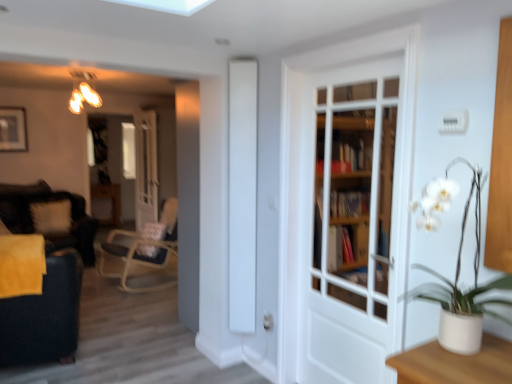
In order to face velvet black swivel chair at left, should I rotate leftwards or rightwards?

Turn left approximately 27.344 degrees to face it.

The width and height of the screenshot is (512, 384). Find the location of `velvet black swivel chair at left`. velvet black swivel chair at left is located at coordinates (44, 315).

The image size is (512, 384). What do you see at coordinates (13, 129) in the screenshot?
I see `matte black picture frame at upper left` at bounding box center [13, 129].

The width and height of the screenshot is (512, 384). What do you see at coordinates (146, 168) in the screenshot? I see `white glossy door at center, placed as the 2th door when sorted from right to left` at bounding box center [146, 168].

Describe the element at coordinates (83, 92) in the screenshot. I see `matte brass chandelier at upper left` at that location.

The height and width of the screenshot is (384, 512). I want to click on white fluffy pillow at left, so click(52, 216).

Where is `velvet black swivel chair at left`? The height and width of the screenshot is (384, 512). velvet black swivel chair at left is located at coordinates (44, 315).

Would you say white glossy door at center, the second door in the front-to-back sequence, is outside white ceramic vase at right?

Yes, white glossy door at center, the second door in the front-to-back sequence, is outside of white ceramic vase at right.

What's the angular difference between white glossy door at center, positioned as the 1th door in back-to-front order, and white ceramic vase at right's facing directions?

The angular difference between white glossy door at center, positioned as the 1th door in back-to-front order, and white ceramic vase at right is 5.08 degrees.

From a real-world perspective, is white glossy door at center, the second door in the front-to-back sequence, physically located above or below white ceramic vase at right?

From a real-world perspective, white glossy door at center, the second door in the front-to-back sequence, is physically below white ceramic vase at right.

Does white glossy door at center, positioned as the first door in left-to-right order, appear on the left side of white ceramic vase at right?

Yes, white glossy door at center, positioned as the first door in left-to-right order, is to the left of white ceramic vase at right.

From a real-world perspective, relative to white fluffy pillow at left, is white glossy door at center, placed as the 2th door when sorted from right to left, vertically above or below?

white glossy door at center, placed as the 2th door when sorted from right to left, is situated higher than white fluffy pillow at left in the real world.

Does white glossy door at center, positioned as the 1th door in back-to-front order, contain white fluffy pillow at left?

No, white fluffy pillow at left is not surrounded by white glossy door at center, positioned as the 1th door in back-to-front order.

Considering the sizes of objects white glossy door at center, the second door in the front-to-back sequence, and white fluffy pillow at left in the image provided, who is wider, white glossy door at center, the second door in the front-to-back sequence, or white fluffy pillow at left?

Wider between the two is white fluffy pillow at left.

From a real-world perspective, count 1st doors upward from the white fluffy pillow at left and point to it. Please provide its 2D coordinates.

[(146, 168)]

I want to click on light fixture in front of the matte black picture frame at upper left, so click(83, 92).

In terms of width, does matte brass chandelier at upper left look wider or thinner when compared to matte black picture frame at upper left?

In the image, matte brass chandelier at upper left appears to be wider than matte black picture frame at upper left.

Considering the sizes of objects matte brass chandelier at upper left and matte black picture frame at upper left in the image provided, who is taller, matte brass chandelier at upper left or matte black picture frame at upper left?

matte black picture frame at upper left is taller.

How different are the orientations of matte brass chandelier at upper left and matte black picture frame at upper left in degrees?

They differ by 0.832 degrees in their facing directions.

Which is nearer, [452,282] or [8,119]?

Clearly, point [452,282] is closer to the camera than point [8,119].

Locate an element on the screen. This screenshot has width=512, height=384. picture frame behind the white ceramic vase at right is located at coordinates pyautogui.click(x=13, y=129).

Which of these two, white ceramic vase at right or matte black picture frame at upper left, is smaller?

matte black picture frame at upper left is smaller.

Looking at the image, does white glossy screen door at center seem bigger or smaller compared to white wooden door at center, placed as the 1th door when sorted from front to back?

Clearly, white glossy screen door at center is smaller in size than white wooden door at center, placed as the 1th door when sorted from front to back.

Between white glossy screen door at center and white wooden door at center, the second door when ordered from left to right, which one is positioned in front?

white wooden door at center, the second door when ordered from left to right.

Is white glossy screen door at center far from white wooden door at center, the second door when ordered from left to right?

Actually, white glossy screen door at center and white wooden door at center, the second door when ordered from left to right, are a little close together.

Identify the location of screen door above the white wooden door at center, which is the 1th door from right to left (from a real-world perspective). Image resolution: width=512 pixels, height=384 pixels. (242, 194).

Is white wooden door at center, placed as the second door when sorted from back to front, looking in the opposite direction of matte black picture frame at upper left?

No, white wooden door at center, placed as the second door when sorted from back to front, is not facing away from matte black picture frame at upper left.

Is white wooden door at center, placed as the second door when sorted from back to front, surrounding matte black picture frame at upper left?

That's incorrect, matte black picture frame at upper left is not inside white wooden door at center, placed as the second door when sorted from back to front.

Is point (310, 270) closer to viewer compared to point (20, 135)?

Yes, it is in front of point (20, 135).

This screenshot has width=512, height=384. I want to click on door in front of the matte black picture frame at upper left, so click(x=350, y=222).

Consider the image. Is white fluffy pillow at left inside white glossy screen door at center?

No, white fluffy pillow at left is located outside of white glossy screen door at center.

Is white glossy screen door at center bigger or smaller than white fluffy pillow at left?

Clearly, white glossy screen door at center is smaller in size than white fluffy pillow at left.

Is white glossy screen door at center shorter than white fluffy pillow at left?

In fact, white glossy screen door at center may be taller than white fluffy pillow at left.

The width and height of the screenshot is (512, 384). Identify the location of houseplant located below the white glossy door at center, the second door in the front-to-back sequence (from the image's perspective). (463, 288).

This screenshot has height=384, width=512. I want to click on pillow on the left of white glossy door at center, the second door in the front-to-back sequence, so click(52, 216).

Estimate the real-world distances between objects in this image. Which object is closer to white ceramic vase at right, white glossy door at center, positioned as the first door in left-to-right order, or matte brass chandelier at upper left?

matte brass chandelier at upper left.

Looking at the image, which one is located further to matte brass chandelier at upper left, white glossy door at center, placed as the 2th door when sorted from right to left, or matte black picture frame at upper left?

white glossy door at center, placed as the 2th door when sorted from right to left.

From the image, which object appears to be nearer to white wooden door at center, placed as the second door when sorted from back to front, matte black picture frame at upper left or white glossy door at center, placed as the 2th door when sorted from right to left?

white glossy door at center, placed as the 2th door when sorted from right to left.

Based on their spatial positions, is matte black picture frame at upper left or white glossy door at center, placed as the 2th door when sorted from right to left, closer to white ceramic vase at right?

matte black picture frame at upper left lies closer to white ceramic vase at right than the other object.

From the picture: Looking at the image, which one is located further to white fluffy pillow at left, white ceramic vase at right or matte black picture frame at upper left?

white ceramic vase at right is further to white fluffy pillow at left.

Considering their positions, is matte brass chandelier at upper left positioned further to white glossy screen door at center than white fluffy pillow at left?

matte brass chandelier at upper left is further to white glossy screen door at center.

Based on their spatial positions, is white ceramic vase at right or white fluffy pillow at left closer to matte brass chandelier at upper left?

white fluffy pillow at left lies closer to matte brass chandelier at upper left than the other object.

When comparing their distances from white glossy screen door at center, does matte black picture frame at upper left or white fluffy pillow at left seem closer?

white fluffy pillow at left is closer to white glossy screen door at center.

This screenshot has width=512, height=384. What are the coordinates of `door between velvet black swivel chair at left and white ceramic vase at right` in the screenshot? It's located at (350, 222).

Find the location of a particular element. The height and width of the screenshot is (384, 512). swivel chair between white wooden door at center, placed as the 1th door when sorted from front to back, and matte black picture frame at upper left in the front-back direction is located at coordinates (44, 315).

The width and height of the screenshot is (512, 384). In order to click on pillow located between white wooden door at center, the second door when ordered from left to right, and white glossy door at center, the second door in the front-to-back sequence, in the depth direction in this screenshot , I will do `click(52, 216)`.

Locate an element on the screen. This screenshot has height=384, width=512. pillow between matte brass chandelier at upper left and white glossy door at center, the second door in the front-to-back sequence, along the z-axis is located at coordinates (52, 216).